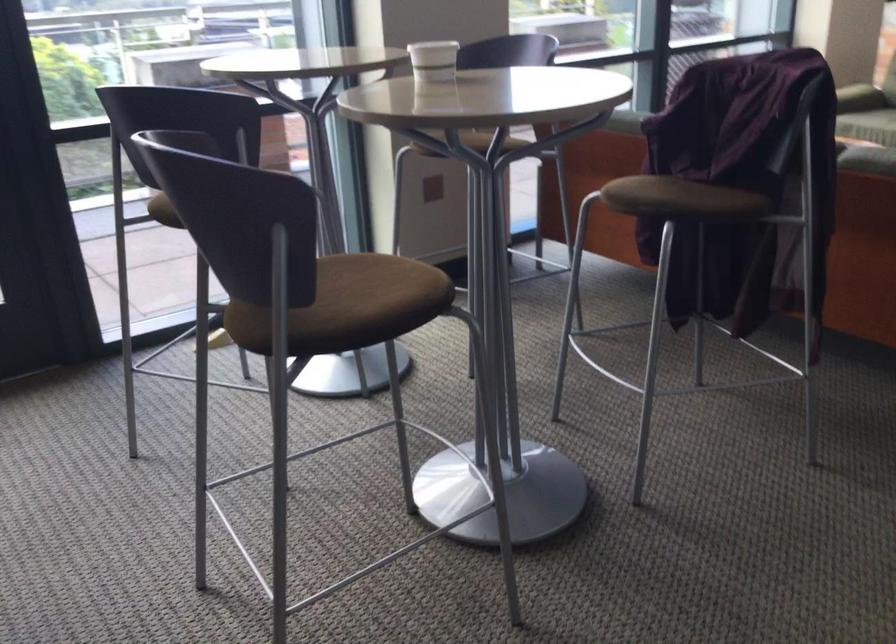
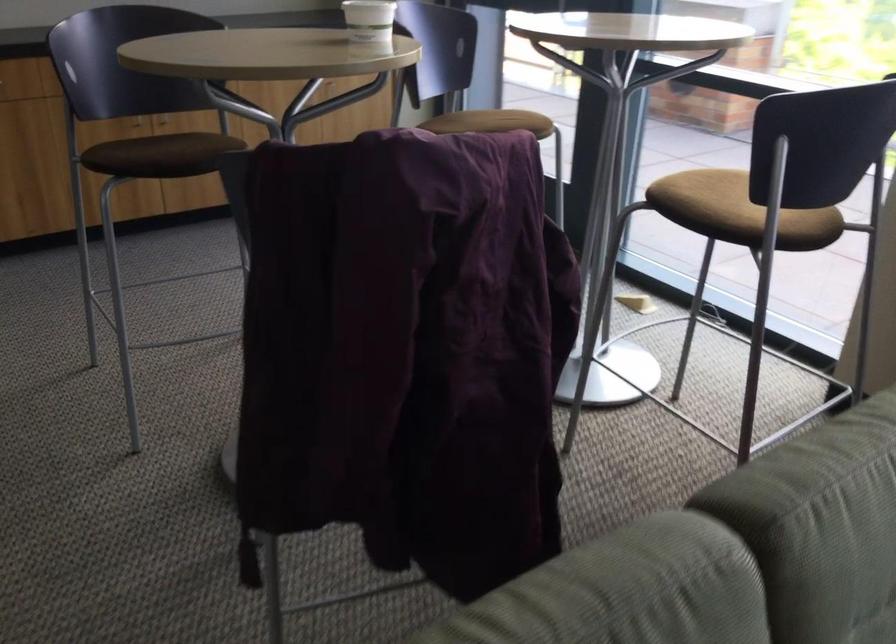
The point at (446,272) is marked in the first image. Where is the corresponding point in the second image?

(173, 160)